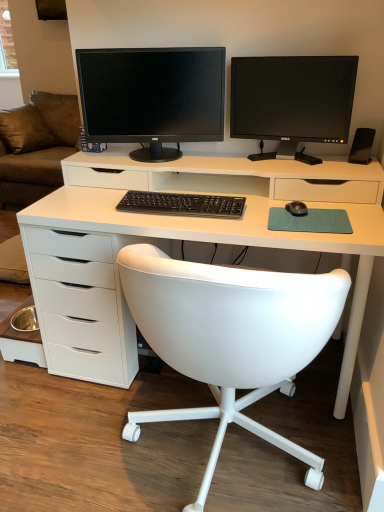
Question: Is black plastic speaker at right positioned with its back to white leather chair at center?

Choices:
 (A) no
 (B) yes

Answer: (A)

Question: Is black plastic speaker at right positioned far away from white leather chair at center?

Choices:
 (A) no
 (B) yes

Answer: (A)

Question: Is black plastic speaker at right closer to the viewer compared to white leather chair at center?

Choices:
 (A) no
 (B) yes

Answer: (A)

Question: Can you confirm if black plastic speaker at right is taller than white leather chair at center?

Choices:
 (A) no
 (B) yes

Answer: (B)

Question: From a real-world perspective, is black plastic speaker at right located higher than white leather chair at center?

Choices:
 (A) yes
 (B) no

Answer: (A)

Question: Would you say white leather chair at center is to the left or to the right of black glossy monitor at upper center, which is the first computer monitor in left-to-right order, in the picture?

Choices:
 (A) left
 (B) right

Answer: (A)

Question: From a real-world perspective, is white leather chair at center above or below black glossy monitor at upper center, which is the first computer monitor in left-to-right order?

Choices:
 (A) above
 (B) below

Answer: (B)

Question: From the image's perspective, is white leather chair at center located above or below black glossy monitor at upper center, the 2th computer monitor in the right-to-left sequence?

Choices:
 (A) below
 (B) above

Answer: (A)

Question: In terms of width, does white leather chair at center look wider or thinner when compared to black glossy monitor at upper center, the 2th computer monitor in the right-to-left sequence?

Choices:
 (A) wide
 (B) thin

Answer: (A)

Question: Based on their sizes in the image, would you say white matte desk at center is bigger or smaller than black matte mouse at right?

Choices:
 (A) small
 (B) big

Answer: (B)

Question: In terms of width, does white matte desk at center look wider or thinner when compared to black matte mouse at right?

Choices:
 (A) wide
 (B) thin

Answer: (A)

Question: Considering the relative positions of white matte desk at center and black matte mouse at right in the image provided, is white matte desk at center to the left or to the right of black matte mouse at right?

Choices:
 (A) left
 (B) right

Answer: (A)

Question: From a real-world perspective, is white matte desk at center above or below black matte mouse at right?

Choices:
 (A) above
 (B) below

Answer: (B)

Question: From the image's perspective, is white leather chair at center above or below black glossy monitor at upper right, which is counted as the 1th computer monitor, starting from the right?

Choices:
 (A) below
 (B) above

Answer: (A)

Question: Is point (299, 326) closer or farther from the camera than point (266, 82)?

Choices:
 (A) farther
 (B) closer

Answer: (B)